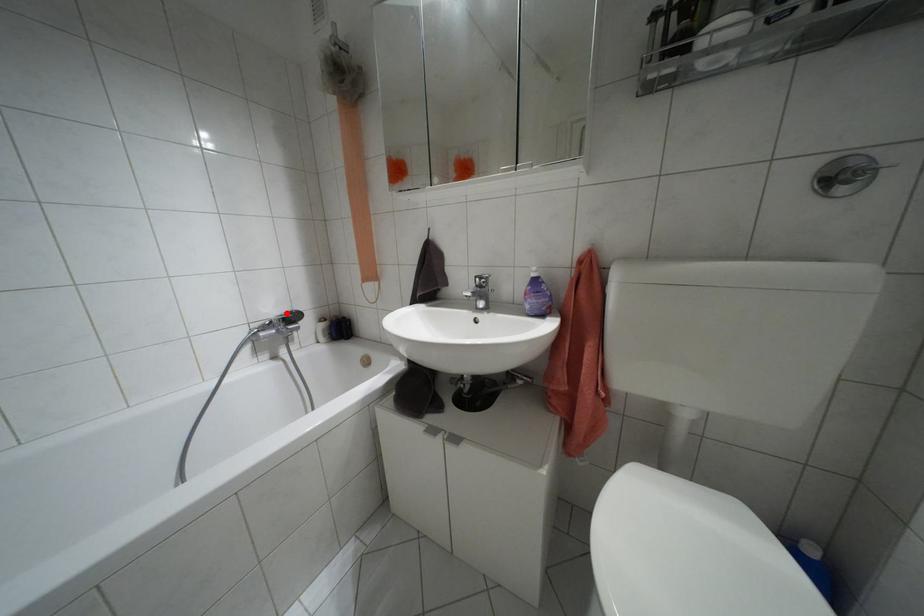
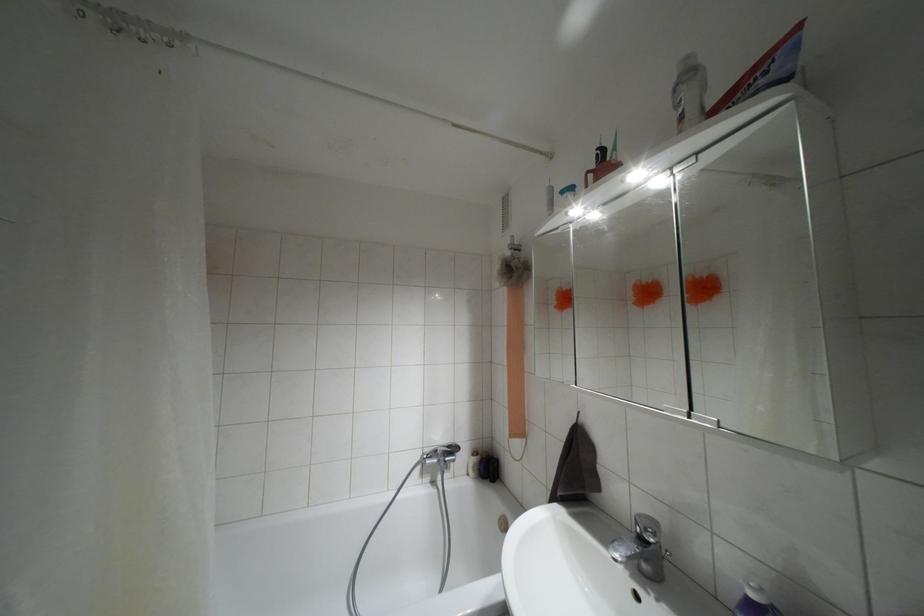
The point at the highlighted location is marked in the first image. Where is the corresponding point in the second image?

(447, 446)